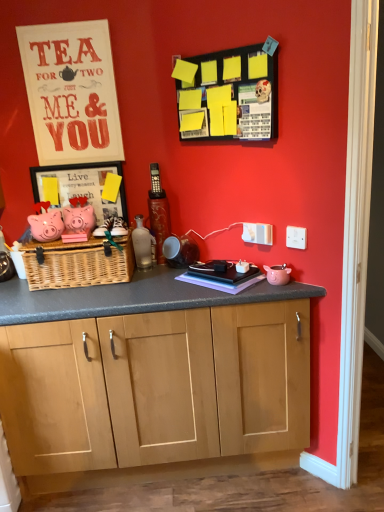
Question: Is purple matte book at center situated inside yellow paper at upper center or outside?

Choices:
 (A) outside
 (B) inside

Answer: (A)

Question: Is purple matte book at center taller or shorter than yellow paper at upper center?

Choices:
 (A) short
 (B) tall

Answer: (A)

Question: Estimate the real-world distances between objects in this image. Which object is closer to the wooden framed picture at center left?

Choices:
 (A) purple matte book at center
 (B) matte white signboard at upper left
 (C) woven natural picnic basket at center
 (D) white plastic electric outlet at upper center, marked as the first electric outlet in a left-to-right arrangement
 (E) pink matte piggy bank at left

Answer: (E)

Question: Estimate the real-world distances between objects in this image. Which object is closer to the matte white signboard at upper left?

Choices:
 (A) white plastic electric outlet at upper right, the second electric outlet viewed from the back
 (B) white plastic electric outlet at upper center, the 1th electric outlet in the back-to-front sequence
 (C) pink matte piggy bank at left
 (D) woven natural picnic basket at center
 (E) wooden framed picture at center left

Answer: (E)